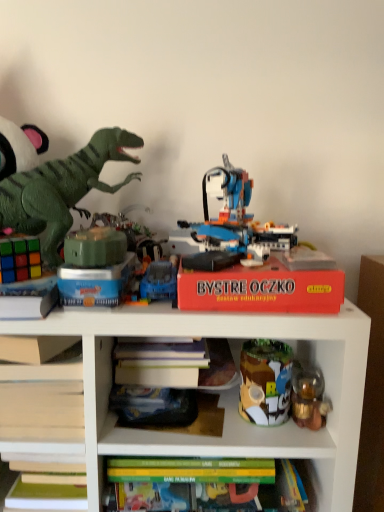
Question: Is metallic tin can at center right, the 2th toy when ordered from right to left, turned away from green matte cube at center, arranged as the fifth toy when viewed from the right?

Choices:
 (A) yes
 (B) no

Answer: (B)

Question: From a real-world perspective, is metallic tin can at center right, the 2th toy when ordered from right to left, located higher than green matte cube at center, arranged as the fifth toy when viewed from the right?

Choices:
 (A) yes
 (B) no

Answer: (B)

Question: Is metallic tin can at center right, which appears as the 6th toy when viewed from the left, to the right of green matte cube at center, arranged as the fifth toy when viewed from the right, from the viewer's perspective?

Choices:
 (A) yes
 (B) no

Answer: (A)

Question: Considering the relative sizes of metallic tin can at center right, which appears as the 6th toy when viewed from the left, and green matte cube at center, arranged as the fifth toy when viewed from the right, in the image provided, is metallic tin can at center right, which appears as the 6th toy when viewed from the left, wider than green matte cube at center, arranged as the fifth toy when viewed from the right,?

Choices:
 (A) no
 (B) yes

Answer: (A)

Question: Could green matte cube at center, placed as the third toy when sorted from left to right, be considered to be inside metallic tin can at center right, the 2th toy when ordered from right to left?

Choices:
 (A) yes
 (B) no

Answer: (B)

Question: Does metallic tin can at center right, which appears as the 6th toy when viewed from the left, have a smaller size compared to green matte cube at center, placed as the third toy when sorted from left to right?

Choices:
 (A) yes
 (B) no

Answer: (B)

Question: Does green matte cube at center, arranged as the fifth toy when viewed from the right, have a lesser width compared to translucent plastic robot at center, arranged as the third toy when viewed from the right?

Choices:
 (A) no
 (B) yes

Answer: (B)

Question: Is the surface of green matte cube at center, placed as the third toy when sorted from left to right, in direct contact with translucent plastic robot at center, arranged as the 5th toy when viewed from the left?

Choices:
 (A) no
 (B) yes

Answer: (A)

Question: Is green matte cube at center, arranged as the fifth toy when viewed from the right, looking in the opposite direction of translucent plastic robot at center, arranged as the 5th toy when viewed from the left?

Choices:
 (A) yes
 (B) no

Answer: (B)

Question: From a real-world perspective, is green matte cube at center, arranged as the fifth toy when viewed from the right, beneath translucent plastic robot at center, arranged as the third toy when viewed from the right?

Choices:
 (A) no
 (B) yes

Answer: (B)

Question: From the image's perspective, would you say green matte cube at center, placed as the third toy when sorted from left to right, is shown under translucent plastic robot at center, arranged as the 5th toy when viewed from the left?

Choices:
 (A) yes
 (B) no

Answer: (A)

Question: Is green matte cube at center, placed as the third toy when sorted from left to right, positioned behind translucent plastic robot at center, arranged as the 5th toy when viewed from the left?

Choices:
 (A) no
 (B) yes

Answer: (A)

Question: From the image's perspective, would you say red cardboard box at upper center is positioned over green plastic dinosaur at left, marked as the second toy in a left-to-right arrangement?

Choices:
 (A) no
 (B) yes

Answer: (A)